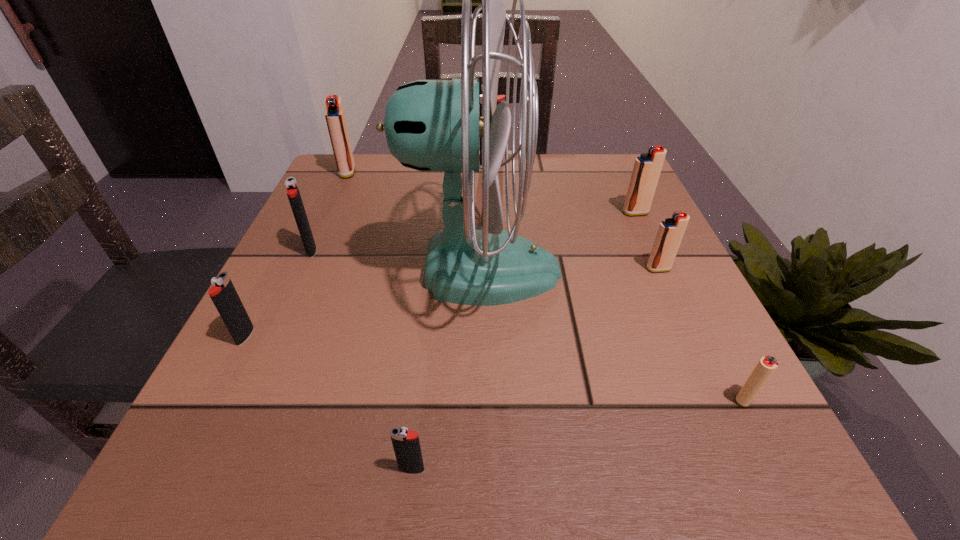
You are a GUI agent. You are given a task and a screenshot of the screen. Output one action in this format:
    pyautogui.click(x=<x>, y=<y>)
    Task: Click on the vacant space located 0.080m on the left of the farthest black igniter
    This screenshot has width=960, height=540.
    Given the screenshot: What is the action you would take?
    pyautogui.click(x=447, y=164)

You are a GUI agent. You are given a task and a screenshot of the screen. Output one action in this format:
    pyautogui.click(x=<x>, y=<y>)
    Task: Click on the free region located 0.400m on the front of the sixth nearest igniter
    This screenshot has width=960, height=540.
    Given the screenshot: What is the action you would take?
    pyautogui.click(x=711, y=375)

Where is `blank space located on the front of the third black igniter from right to left`? This screenshot has height=540, width=960. blank space located on the front of the third black igniter from right to left is located at coordinates (296, 284).

Where is `free space located on the back of the third biggest black igniter`? Image resolution: width=960 pixels, height=540 pixels. free space located on the back of the third biggest black igniter is located at coordinates (319, 193).

Where is `vacant space positioned 0.220m on the left of the third biggest red igniter`? This screenshot has width=960, height=540. vacant space positioned 0.220m on the left of the third biggest red igniter is located at coordinates (525, 269).

This screenshot has width=960, height=540. I want to click on free region located on the front of the smallest red igniter, so click(775, 458).

At what (x,y) coordinates should I click in order to perform the action: click on free region located on the right of the fourth igniter from left to right. Please return your answer as a coordinate pair (x, y). This screenshot has height=540, width=960. Looking at the image, I should click on (707, 469).

You are a GUI agent. You are given a task and a screenshot of the screen. Output one action in this format:
    pyautogui.click(x=<x>, y=<y>)
    Task: Click on the object that is at the near edge
    The width and height of the screenshot is (960, 540).
    Given the screenshot: What is the action you would take?
    pyautogui.click(x=406, y=444)

What are the coordinates of `object that is at the far left corner` in the screenshot? It's located at (335, 117).

In the image, there is a desktop. Find the location of `free space at the far edge`. free space at the far edge is located at coordinates (440, 202).